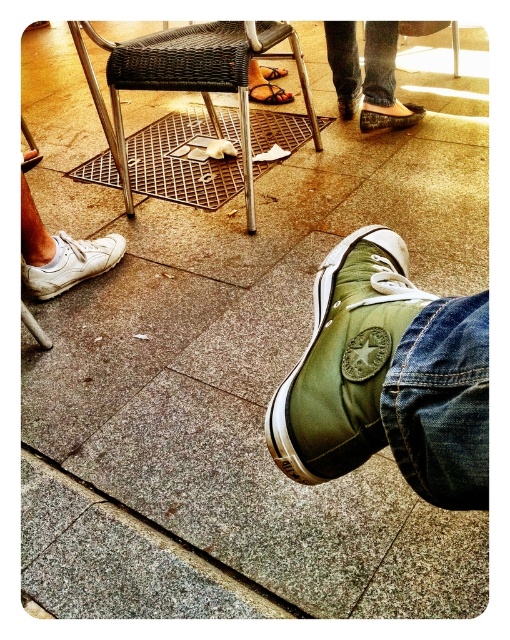
Question: Is olive green canvas shoe at lower right wider than matte olive green shoe at center?

Choices:
 (A) no
 (B) yes

Answer: (A)

Question: Is leather shoe at center further to camera compared to white leather shoe at lower left?

Choices:
 (A) yes
 (B) no

Answer: (A)

Question: Among these points, which one is nearest to the camera?

Choices:
 (A) (283, 93)
 (B) (90, 243)
 (C) (386, 120)
 (D) (352, 109)

Answer: (B)

Question: Can you confirm if woven wicker chair at center is positioned below jeans at center?

Choices:
 (A) yes
 (B) no

Answer: (B)

Question: Among these points, which one is nearest to the camera?

Choices:
 (A) (269, 132)
 (B) (28, 216)

Answer: (B)

Question: Among these objects, which one is nearest to the camera?

Choices:
 (A) brown leather sandal at center
 (B) woven wicker chair at center
 (C) white leather shoe at lower left
 (D) olive green canvas shoe at lower right

Answer: (D)